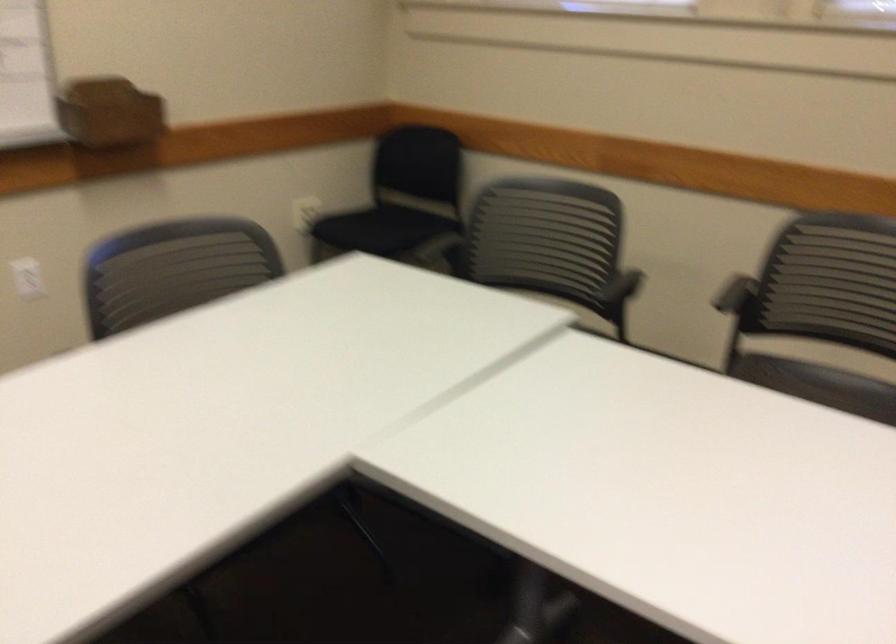
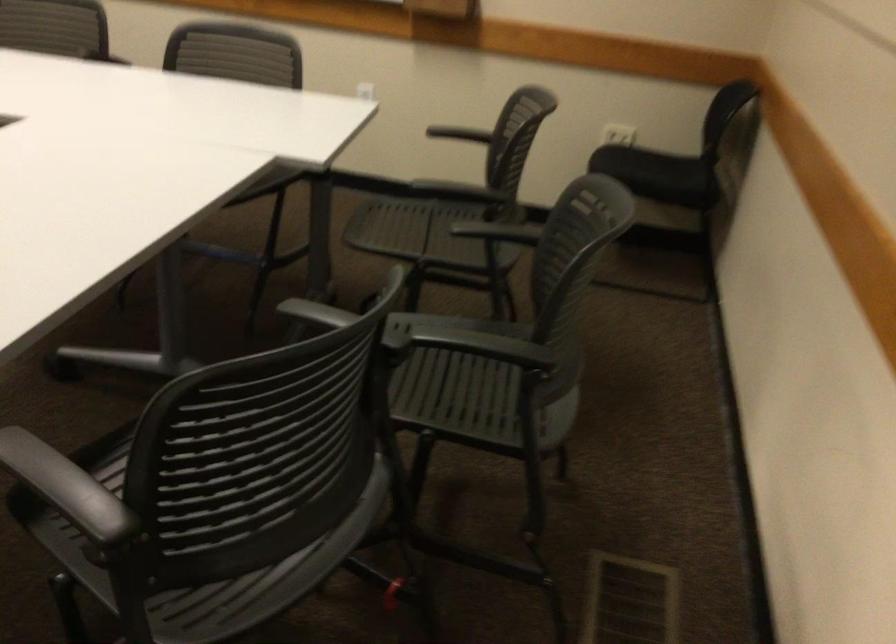
In the second image, find the point that corresponds to (612,287) in the first image.

(461, 190)